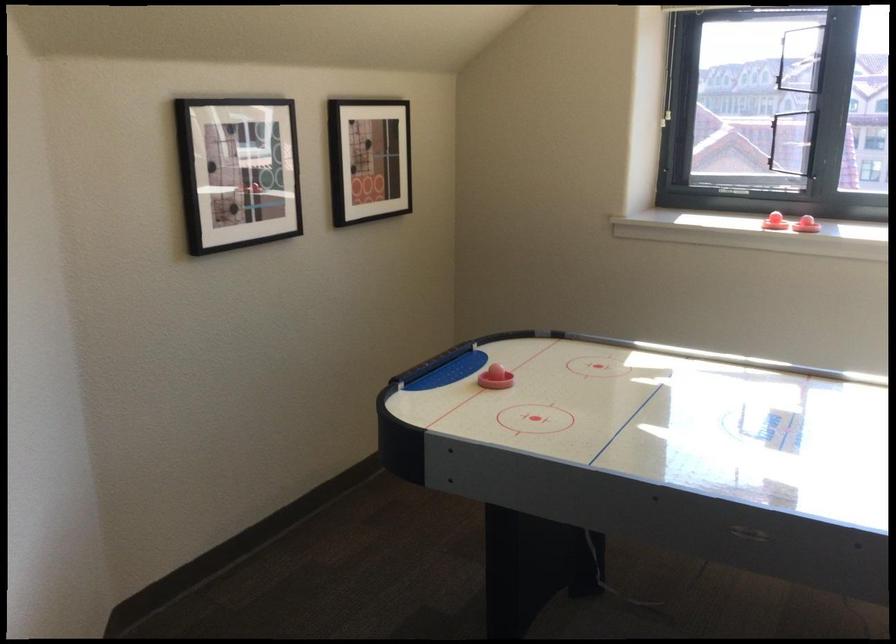
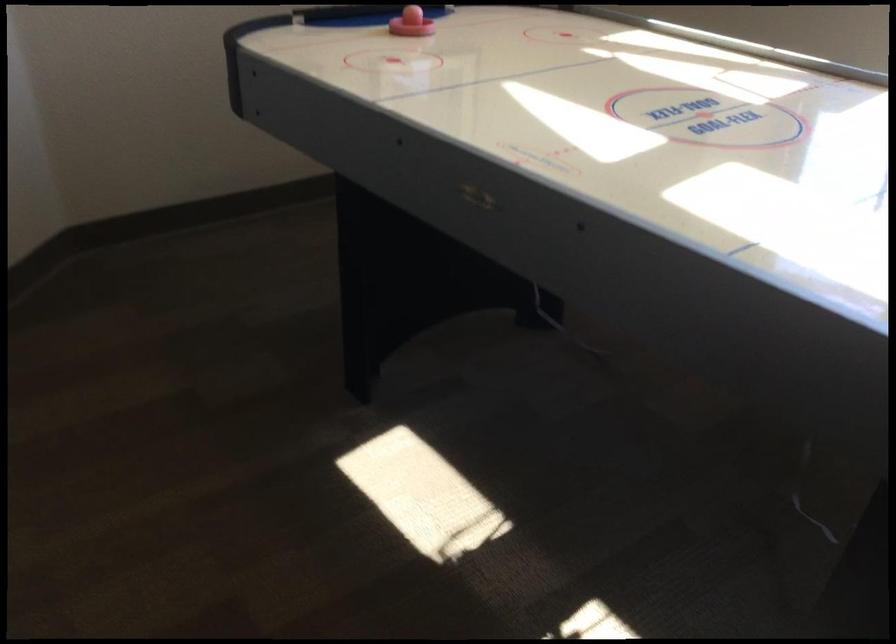
Where in the second image is the point corresponding to point (488, 377) from the first image?

(410, 23)